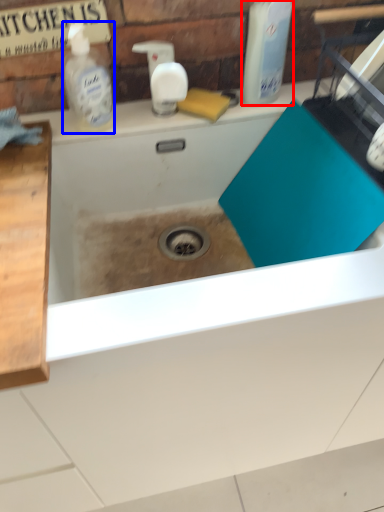
Question: Which object is closer to the camera taking this photo, cleaning product (highlighted by a red box) or cleaning product (highlighted by a blue box)?

Choices:
 (A) cleaning product
 (B) cleaning product

Answer: (A)